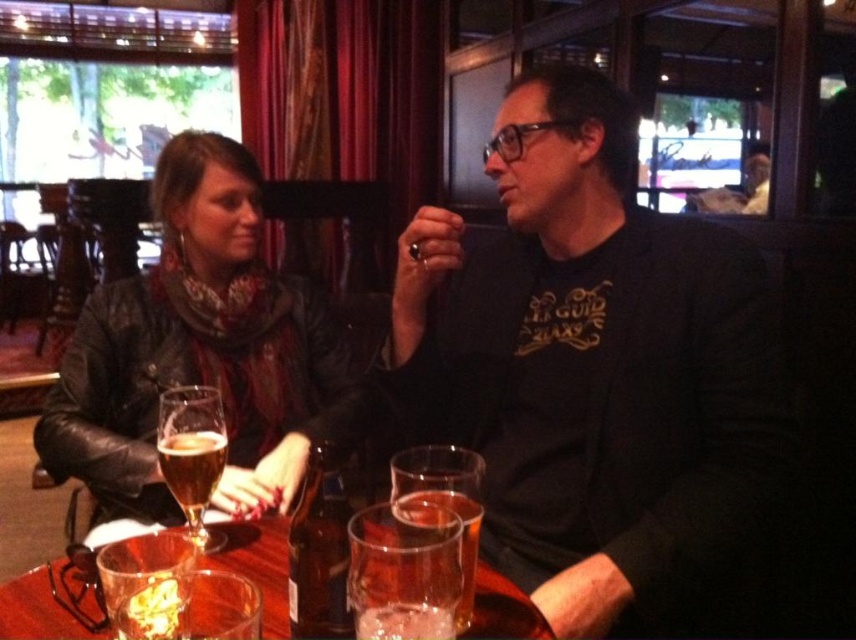
Question: Is translucent glass beer at left bigger than clear glass beer at center?

Choices:
 (A) no
 (B) yes

Answer: (B)

Question: From the image, what is the correct spatial relationship of translucent glass beer at left in relation to clear glass beer at center?

Choices:
 (A) left
 (B) right

Answer: (A)

Question: Which point is farther from the camera taking this photo?

Choices:
 (A) (431, 508)
 (B) (34, 580)
 (C) (223, 276)
 (D) (467, 566)

Answer: (C)

Question: From the image, what is the correct spatial relationship of clear glass wine glass at center in relation to translucent glass beer at center?

Choices:
 (A) left
 (B) right

Answer: (A)

Question: Estimate the real-world distances between objects in this image. Which object is farther from the clear glass beer at center?

Choices:
 (A) amber glass beer at lower left
 (B) translucent glass beer at center
 (C) leather jacket at left

Answer: (C)

Question: Which object is the farthest from the translucent glass beer at center?

Choices:
 (A) clear glass beer at center
 (B) translucent glass beer at left
 (C) leather jacket at left
 (D) clear glass wine glass at center

Answer: (C)